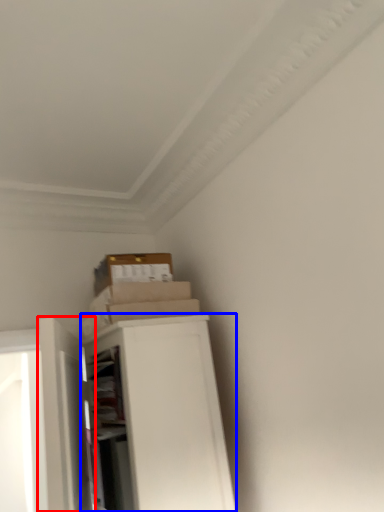
Question: Which point is closer to the camera, door (highlighted by a red box) or file cabinet (highlighted by a blue box)?

Choices:
 (A) door
 (B) file cabinet

Answer: (A)